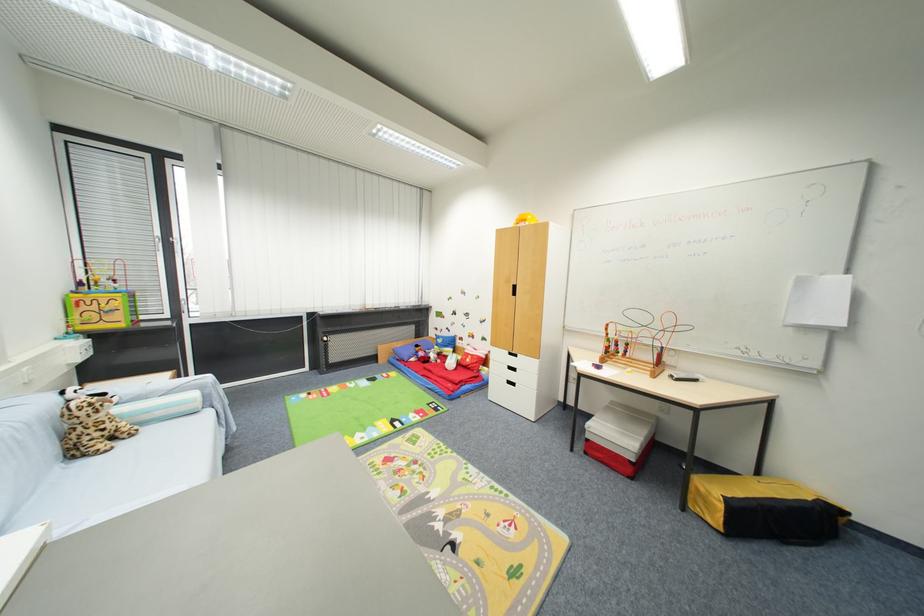
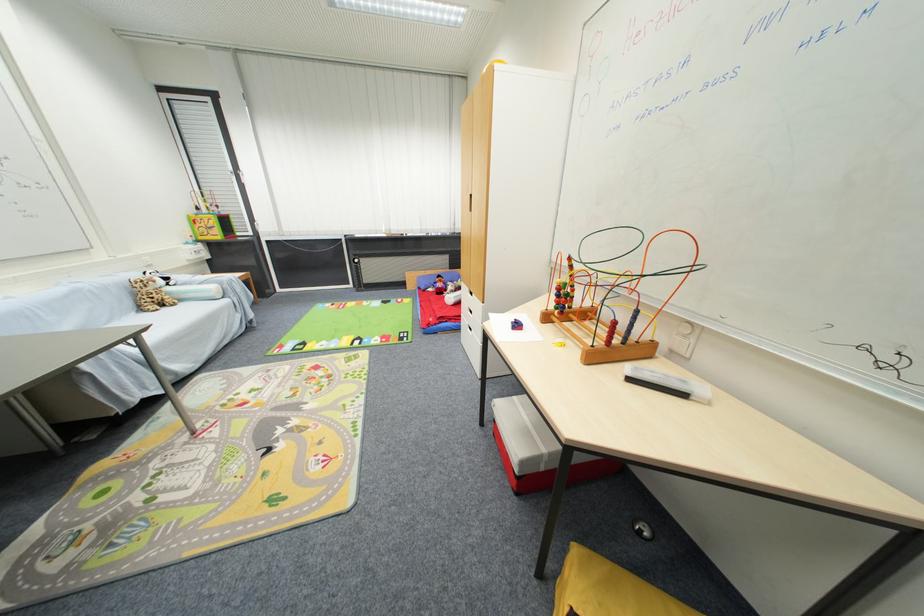
Locate, in the second image, the point that corresponds to [79,456] in the first image.

(146, 310)